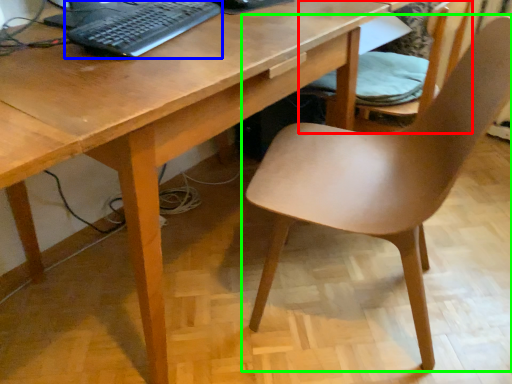
Question: Estimate the real-world distances between objects in this image. Which object is closer to chair (highlighted by a red box), computer keyboard (highlighted by a blue box) or chair (highlighted by a green box)?

Choices:
 (A) computer keyboard
 (B) chair

Answer: (B)